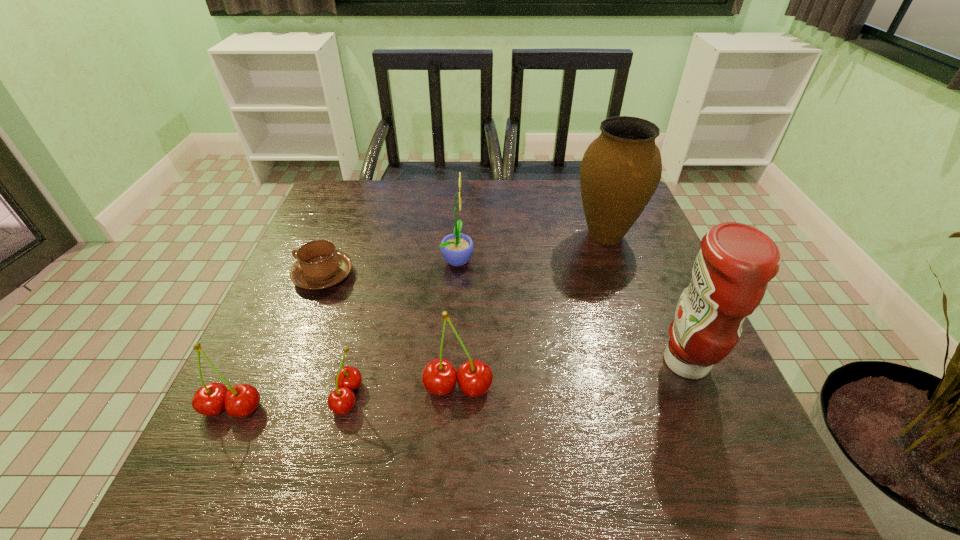
Where is `vacant area that lies between the third shortest object and the second cherry from right to left`? vacant area that lies between the third shortest object and the second cherry from right to left is located at coordinates (290, 402).

The image size is (960, 540). In order to click on vacant space in between the cappuccino and the second shortest cherry in this screenshot , I will do `click(278, 341)`.

This screenshot has height=540, width=960. I want to click on empty location between the condiment and the rightmost cherry, so click(x=572, y=375).

The height and width of the screenshot is (540, 960). I want to click on free space that is in between the rightmost cherry and the third tallest object, so [458, 323].

At what (x,y) coordinates should I click in order to perform the action: click on empty space that is in between the fifth shortest object and the rightmost cherry. Please return your answer as a coordinate pair (x, y). The width and height of the screenshot is (960, 540). Looking at the image, I should click on (458, 323).

The image size is (960, 540). In order to click on unoccupied area between the sunflower and the condiment in this screenshot , I will do `click(572, 311)`.

Select which object is the sixth closest to the rightmost cherry. Please provide its 2D coordinates. Your answer should be formatted as a tuple, i.e. [(x, y)], where the tuple contains the x and y coordinates of a point satisfying the conditions above.

[(620, 171)]

Locate an element on the screen. The image size is (960, 540). object that ranks as the second closest to the condiment is located at coordinates (439, 377).

Point out which cherry is positioned as the second nearest to the rightmost cherry. Please provide its 2D coordinates. Your answer should be formatted as a tuple, i.e. [(x, y)], where the tuple contains the x and y coordinates of a point satisfying the conditions above.

[(241, 400)]

The width and height of the screenshot is (960, 540). I want to click on the second closest cherry relative to the cappuccino, so click(x=241, y=400).